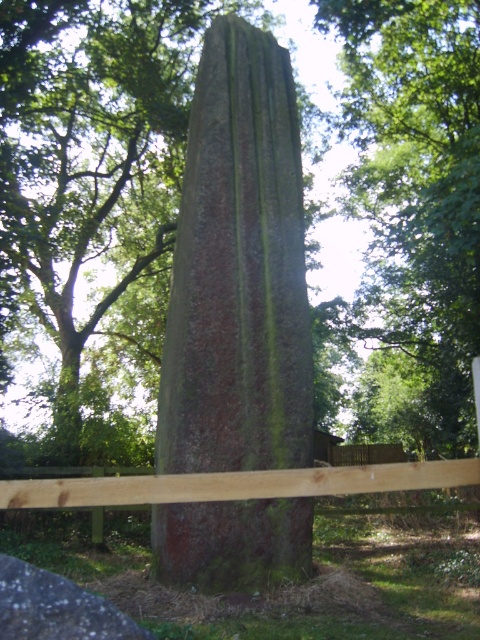
You are standing at the origin point of the coordinate system. You want to move towards the green mossy stone obelisk at center. What direction should you move in to reach it?

The green mossy stone obelisk at center is located at coordinate point 0.328 on the x axis and 0.200 on the y axis. Since you are at the origin, you should move in the positive x and positive y direction to reach it.

You are a painter wanting to sketch the green mossy stone obelisk at center and the brown wooden fence at center. Which object is located to the right of the other?

The green mossy stone obelisk at center is positioned on the right side of brown wooden fence at center.